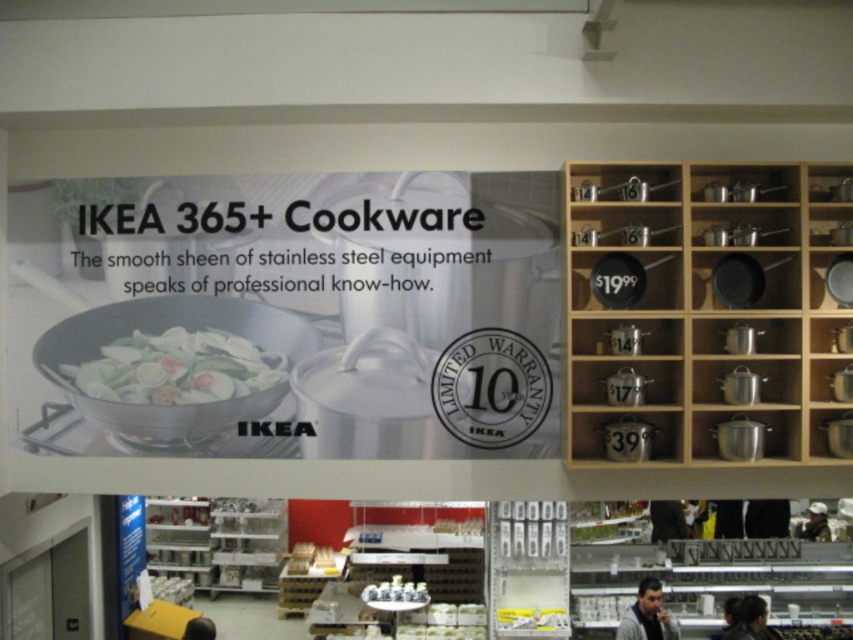
You are an interior designer looking to place a small decorative item on the wooden shelf to the right of the IKEA 365 cookware advertisement. The shelf has limited space, and you want to ensure the item will fit. The coordinates of the shelf are from point A at 0.5 to point B at 0.6 on the x and y axes. Can the green matte vegetables at center fit on this shelf?

The green matte vegetables at center are located at point (x=175, y=369), which falls within the shelf area from 0.5 to 0.6 on both axes. Therefore, the green matte vegetables at center can fit on the shelf.

You are a customer in an IKEA store looking at the cookware section. You see the green matte vegetables at center and the white glossy salt shaker at center. Which object is located to the left of the other?

The green matte vegetables at center is positioned on the left side of white glossy salt shaker at center, so the green matte vegetables at center is to the left of the white glossy salt shaker at center.